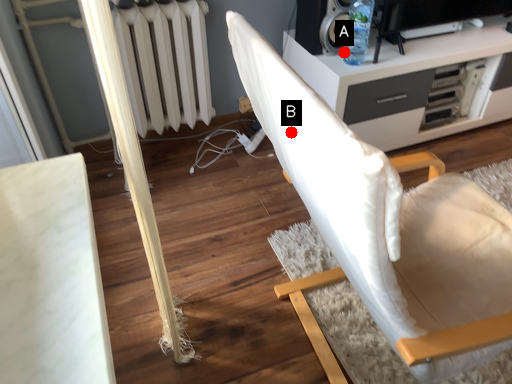
Question: Two points are circled on the image, labeled by A and B beside each circle. Which point is closer to the camera?

Choices:
 (A) A is closer
 (B) B is closer

Answer: (B)